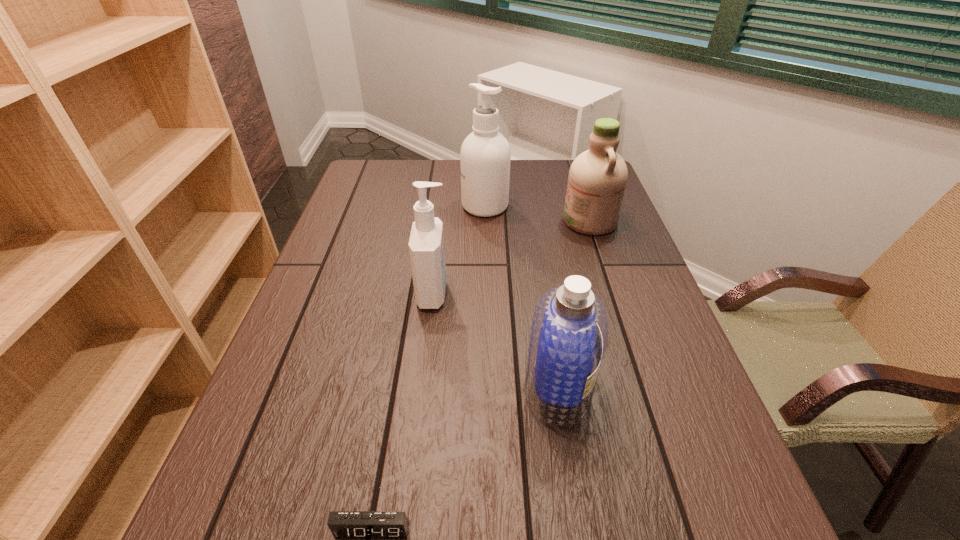
This screenshot has width=960, height=540. Find the location of `free space at the right edge`. free space at the right edge is located at coordinates (603, 276).

This screenshot has width=960, height=540. Find the location of `vacant space at the far left corner of the desktop`. vacant space at the far left corner of the desktop is located at coordinates (382, 193).

You are a GUI agent. You are given a task and a screenshot of the screen. Output one action in this format:
    pyautogui.click(x=<x>, y=<y>)
    Task: Click on the free location at the far right corner of the desktop
    
    Given the screenshot: What is the action you would take?
    pyautogui.click(x=562, y=194)

Locate an element on the screen. This screenshot has height=540, width=960. vacant space that is in between the alarm clock and the tallest object is located at coordinates (429, 368).

The height and width of the screenshot is (540, 960). I want to click on blank region between the third farthest object and the fourth farthest object, so click(x=495, y=341).

This screenshot has width=960, height=540. In order to click on free area in between the second nearest cleansing agent and the rightmost cleansing agent in this screenshot , I will do `click(512, 257)`.

Locate an element on the screen. The image size is (960, 540). free spot between the rightmost cleansing agent and the leftmost cleansing agent is located at coordinates (512, 257).

The image size is (960, 540). I want to click on free space that is in between the nearest cleansing agent and the third farthest cleansing agent, so click(495, 341).

The image size is (960, 540). What are the coordinates of `free space that is in between the tallest object and the rightmost cleansing agent` in the screenshot? It's located at (538, 213).

This screenshot has width=960, height=540. What are the coordinates of `free space between the tallest object and the second nearest object` in the screenshot? It's located at (521, 297).